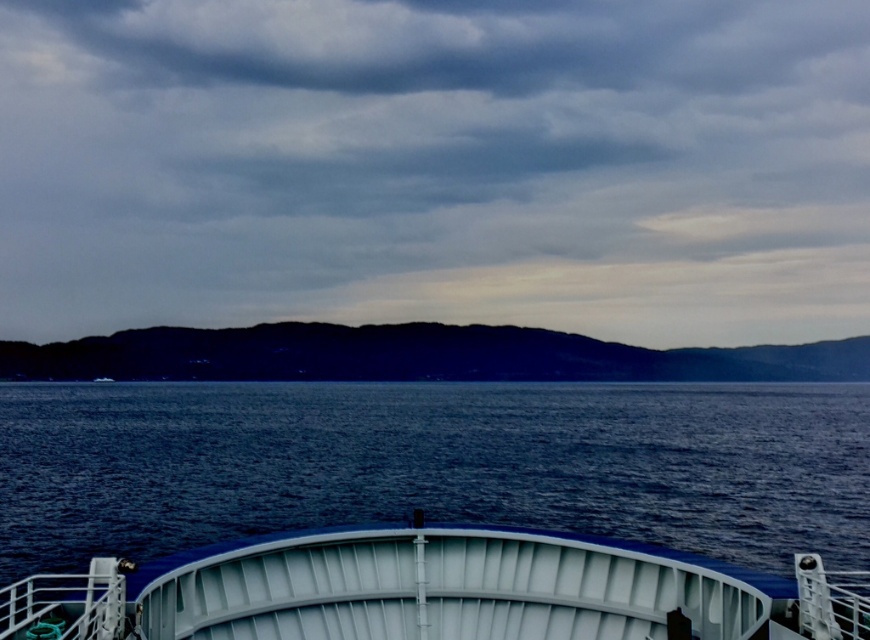
Does gray matte cloud at upper center appear on the left side of white matte boat at center?

Indeed, gray matte cloud at upper center is positioned on the left side of white matte boat at center.

Between gray matte cloud at upper center and white matte boat at center, which one is positioned higher?

gray matte cloud at upper center

Between point (406, 196) and point (717, 611), which one is positioned in front?

Point (717, 611)

This screenshot has width=870, height=640. In order to click on gray matte cloud at upper center in this screenshot , I will do `click(436, 164)`.

Which is behind, point (661, 628) or point (775, 376)?

Positioned behind is point (775, 376).

Between white matte boat at center and dark blue water at center, which one is positioned higher?

white matte boat at center is higher up.

The image size is (870, 640). What do you see at coordinates (435, 592) in the screenshot?
I see `white matte boat at center` at bounding box center [435, 592].

Locate an element on the screen. This screenshot has width=870, height=640. white matte boat at center is located at coordinates (435, 592).

Can you confirm if gray matte cloud at upper center is positioned to the left of dark blue water at center?

Yes, gray matte cloud at upper center is to the left of dark blue water at center.

Can you confirm if gray matte cloud at upper center is taller than dark blue water at center?

Indeed, gray matte cloud at upper center has a greater height compared to dark blue water at center.

Image resolution: width=870 pixels, height=640 pixels. Describe the element at coordinates (436, 164) in the screenshot. I see `gray matte cloud at upper center` at that location.

Find the location of a particular element. This screenshot has height=640, width=870. gray matte cloud at upper center is located at coordinates (436, 164).